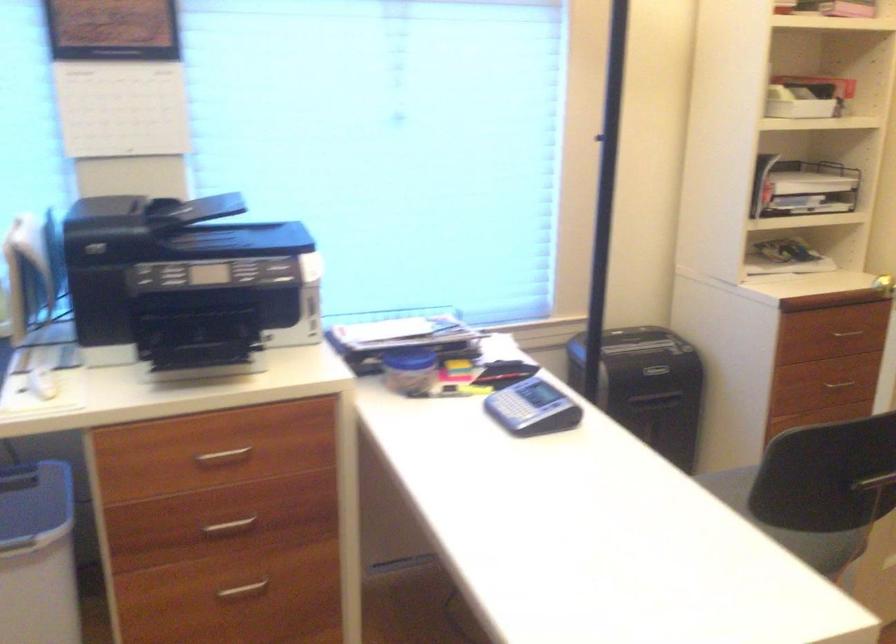
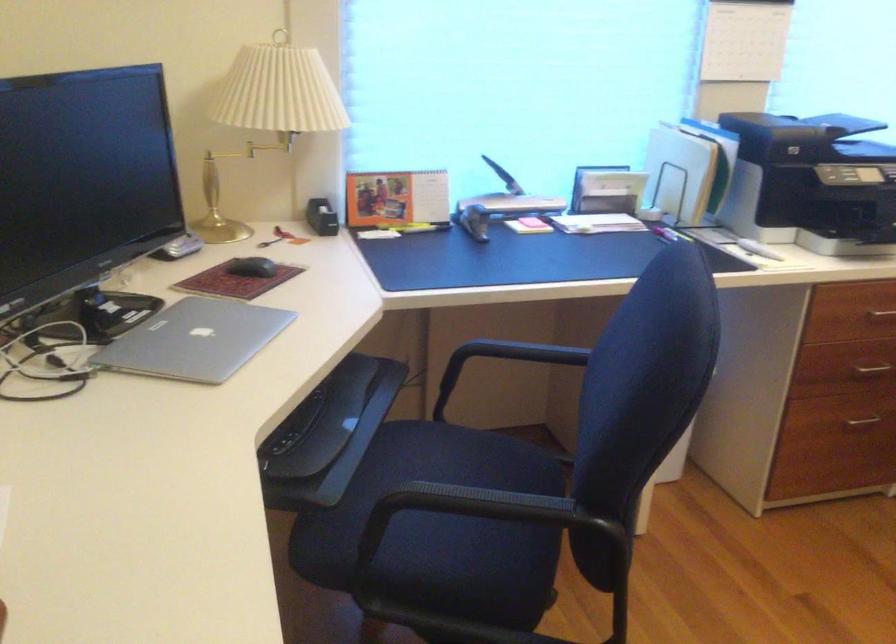
Question: I am providing you with two images of the same scene from different viewpoints. Please identify which objects are invisible in image2.

Choices:
 (A) blue waste bin
 (B) grey stapler
 (C) pink chalk piece
 (D) chair sitting surface

Answer: (A)